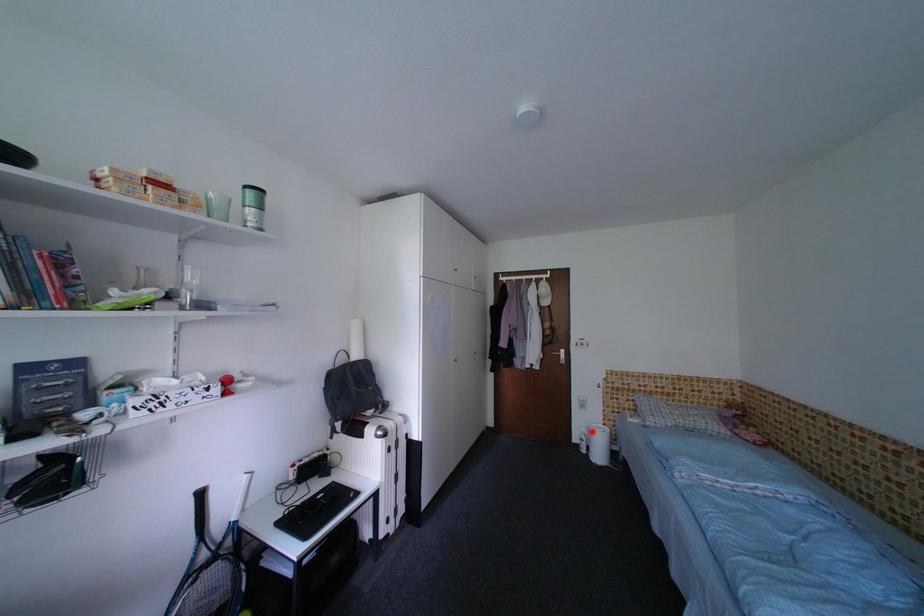
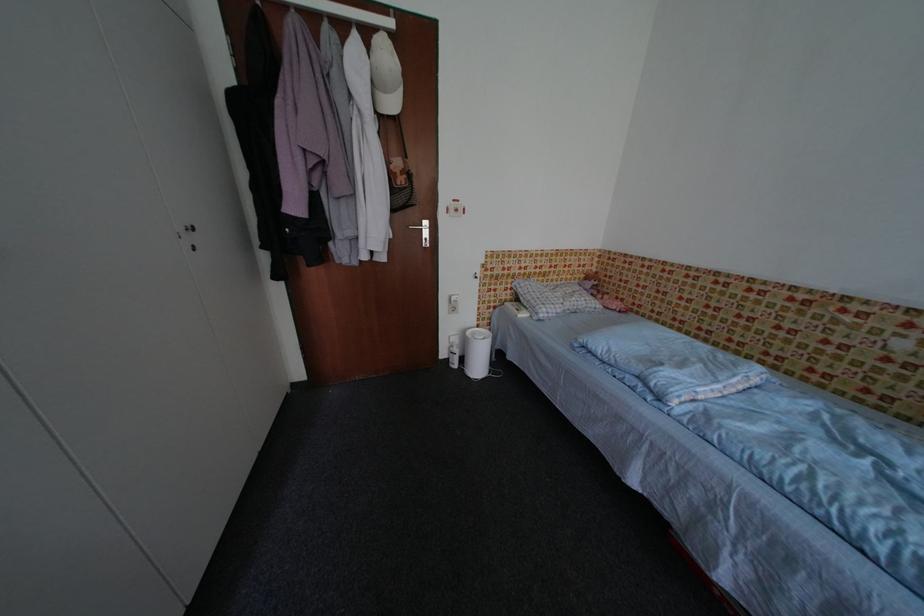
Question: I am providing you with two images of the same scene from different viewpoints. Given a red point in image1, look at the same physical point in image2. Is it:

Choices:
 (A) Closer to the viewpoint
 (B) Farther from the viewpoint

Answer: (A)